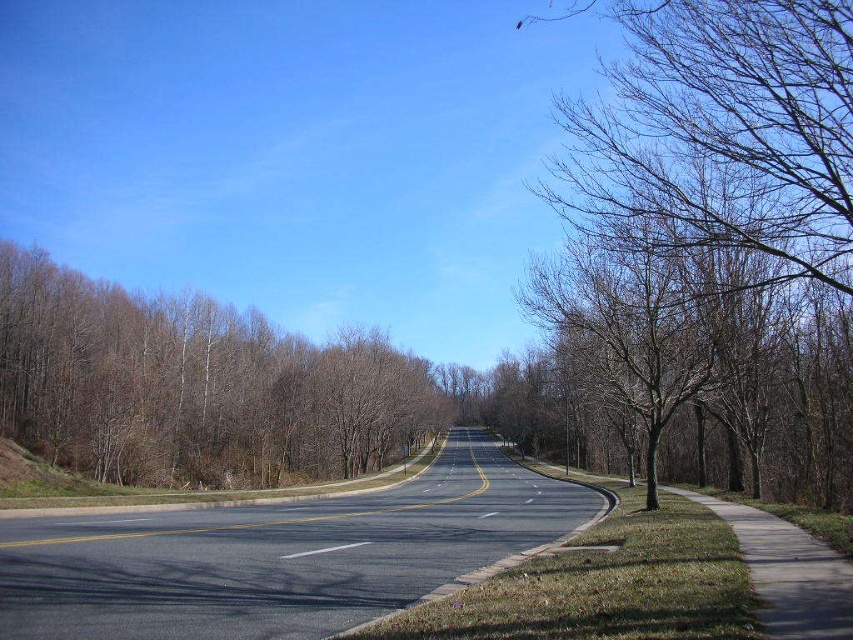
Question: Can you confirm if bare branches at right is thinner than brown/dry wood trees at left?

Choices:
 (A) yes
 (B) no

Answer: (A)

Question: Is the position of bare branches at right more distant than that of brown/dry wood trees at left?

Choices:
 (A) no
 (B) yes

Answer: (A)

Question: Among these objects, which one is farthest from the camera?

Choices:
 (A) brown/dry wood trees at left
 (B) bare branches at right

Answer: (A)

Question: Can you confirm if bare branches at right is positioned below brown/dry wood trees at left?

Choices:
 (A) yes
 (B) no

Answer: (B)